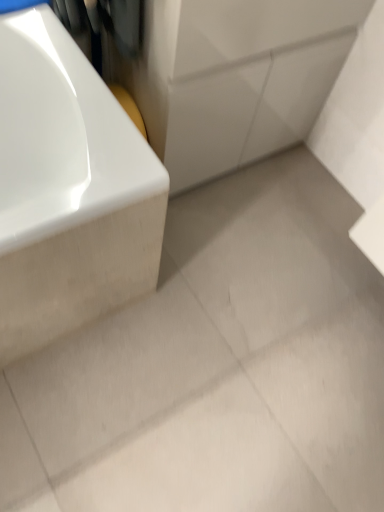
The height and width of the screenshot is (512, 384). Describe the element at coordinates (217, 367) in the screenshot. I see `white glossy concrete at lower left` at that location.

Locate an element on the screen. white glossy concrete at lower left is located at coordinates (217, 367).

The width and height of the screenshot is (384, 512). Identify the location of white glossy concrete at lower left. (217, 367).